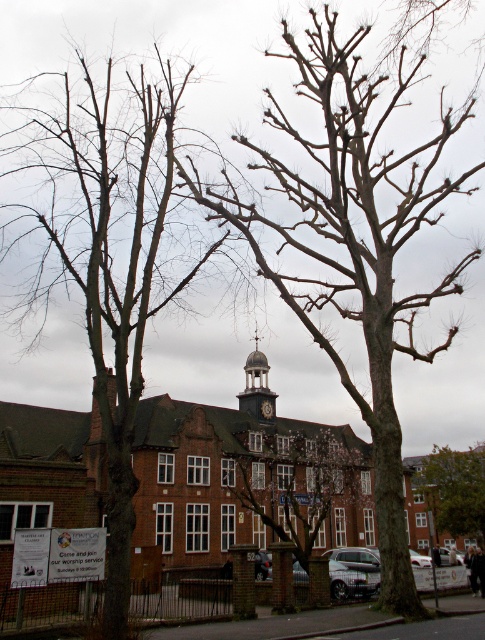
You are a photographer wanting to capture both the bare wood tree at center and the dark gray stone clock tower at center in a single frame. Given their sizes, which object would appear more dominant in the photo?

The bare wood tree at center is larger in size than the dark gray stone clock tower at center, so it would appear more dominant in the photo.

You are standing in front of the large brick building with a clock tower and want to locate two specific points marked in the image. The first point is at coordinates point (x=339, y=474) and the second is at point (x=271, y=410). Which of these two points is closer to the viewer?

Point (x=271, y=410) is closer to the viewer because the point (x=339, y=474) is behind it.

You are a photographer standing at a certain distance from the brown textured tree at center. You want to capture an image where the tree fills the frame without cropping any part of it. Given that your camera has a focal length of 35mm and the tree is 10 meters tall, what is the minimum distance you should maintain from the tree to achieve this?

The minimum distance should be approximately 35 meters. This is calculated using the formula distance equals focal length divided by the ratio of subject height to desired image height. Since the tree is 10 meters tall and the camera sensor can accommodate a subject height of 1 meter at 35mm focal length, the calculation would be 35mm divided by 10 meters equals 3.5 meters, but considering the sensor size and desired framing, the actual minimum distance is around 35 meters.